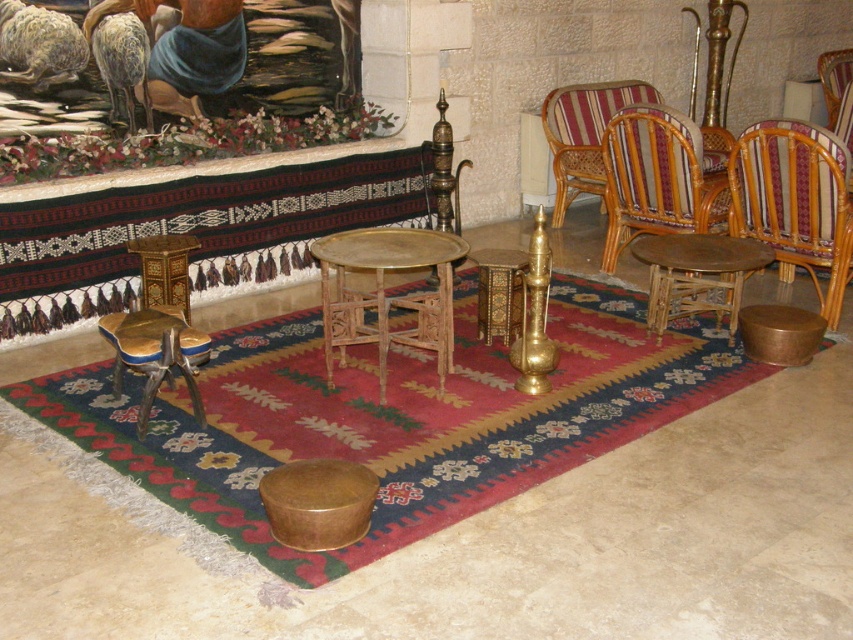
You are arranging flowers for a special event in the living room. You have a bouquet of roses that needs to be placed on a stool. The gold polished stool at lower left and the gold textured stool at center are both available. Which stool is positioned to the left of the other?

The gold polished stool at lower left is to the left of the gold textured stool at center.

You are standing at the center of the room and want to move to the point marked as point [657,179]. Which object is located at that point?

The point [657,179] is located on the rattan armchair at center.

You are standing in the living room and want to place a small vase exactly halfway between point (558,184) and point (109,326). Considering the perspective from your position, will the vase be closer to the camera or further away compared to the central wooden table?

The vase placed halfway between point (558,184) and point (109,326) will be closer to the camera than the central wooden table because point (558,184) is further to the camera than point (109,326), so the midpoint would be closer to the camera than the central table.